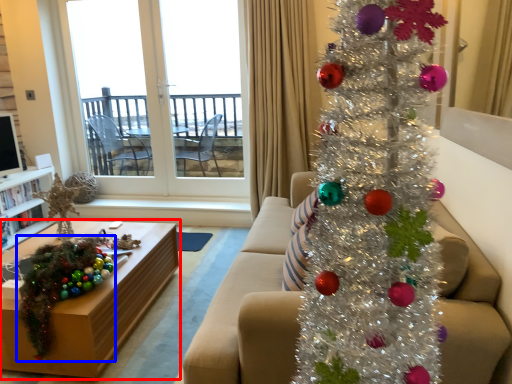
Question: Which point is further to the camera, table (highlighted by a red box) or christmas decoration (highlighted by a blue box)?

Choices:
 (A) table
 (B) christmas decoration

Answer: (A)